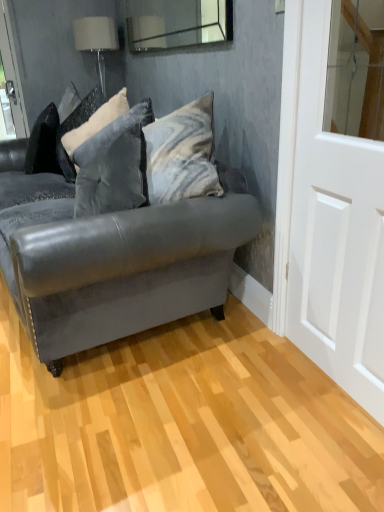
Question: From a real-world perspective, is clear glass mirror at upper center positioned under white fabric lampshade at upper left based on gravity?

Choices:
 (A) yes
 (B) no

Answer: (B)

Question: Is clear glass mirror at upper center oriented away from white fabric lampshade at upper left?

Choices:
 (A) yes
 (B) no

Answer: (B)

Question: Is clear glass mirror at upper center next to white fabric lampshade at upper left and touching it?

Choices:
 (A) no
 (B) yes

Answer: (A)

Question: Can you confirm if clear glass mirror at upper center is bigger than white fabric lampshade at upper left?

Choices:
 (A) no
 (B) yes

Answer: (A)

Question: Would you consider clear glass mirror at upper center to be distant from white fabric lampshade at upper left?

Choices:
 (A) no
 (B) yes

Answer: (A)

Question: Does clear glass mirror at upper center appear on the right side of white fabric lampshade at upper left?

Choices:
 (A) no
 (B) yes

Answer: (B)

Question: Is velvet gray pillow at center, placed as the 2th pillow when sorted from back to front, in front of matte gray leather couch at center?

Choices:
 (A) yes
 (B) no

Answer: (B)

Question: Can you confirm if velvet gray pillow at center, placed as the 2th pillow when sorted from back to front, is positioned to the left of matte gray leather couch at center?

Choices:
 (A) yes
 (B) no

Answer: (B)

Question: Can you confirm if velvet gray pillow at center, placed as the 2th pillow when sorted from back to front, is shorter than matte gray leather couch at center?

Choices:
 (A) yes
 (B) no

Answer: (A)

Question: Is velvet gray pillow at center, placed as the first pillow when sorted from front to back, placed right next to matte gray leather couch at center?

Choices:
 (A) no
 (B) yes

Answer: (A)

Question: From the image's perspective, does velvet gray pillow at center, placed as the first pillow when sorted from front to back, appear higher than matte gray leather couch at center?

Choices:
 (A) yes
 (B) no

Answer: (A)

Question: Is there a large distance between velvet gray pillow at center, placed as the first pillow when sorted from front to back, and matte gray leather couch at center?

Choices:
 (A) no
 (B) yes

Answer: (A)

Question: Is white glossy door at right completely or partially outside of clear glass mirror at upper center?

Choices:
 (A) yes
 (B) no

Answer: (A)